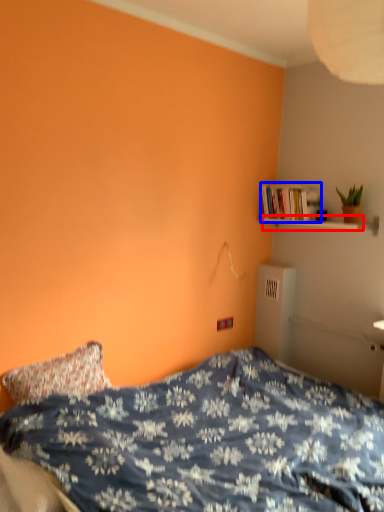
Question: Which object is closer to the camera taking this photo, shelf (highlighted by a red box) or book (highlighted by a blue box)?

Choices:
 (A) shelf
 (B) book

Answer: (A)